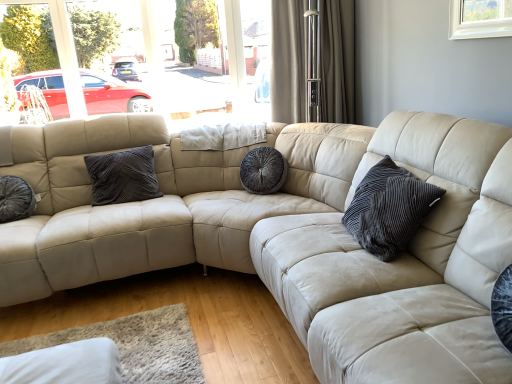
This screenshot has height=384, width=512. I want to click on beige leather couch at center, so click(x=290, y=235).

The width and height of the screenshot is (512, 384). What do you see at coordinates (123, 176) in the screenshot?
I see `dark grey velvet pillow at center, the second pillow when ordered from left to right` at bounding box center [123, 176].

You are a GUI agent. You are given a task and a screenshot of the screen. Output one action in this format:
    pyautogui.click(x=<x>, y=<y>)
    Task: Click on the velvet dark gray pillow at center, marked as the 3th pillow in a back-to-front arrangement
    This screenshot has width=512, height=384.
    Given the screenshot: What is the action you would take?
    pyautogui.click(x=389, y=209)

The image size is (512, 384). I want to click on velvet dark gray pillow at left, the 1th pillow viewed from the left, so click(x=16, y=199).

What do you see at coordinates (337, 61) in the screenshot? Image resolution: width=512 pixels, height=384 pixels. I see `beige textured curtain at upper center` at bounding box center [337, 61].

The height and width of the screenshot is (384, 512). What are the coordinates of `beige leather couch at center` in the screenshot? It's located at (290, 235).

Consider the image. Who is bigger, beige leather couch at center or velvet dark gray pillow at left, which appears as the 3th pillow when viewed from the right?

beige leather couch at center.

Which object is positioned more to the right, beige leather couch at center or velvet dark gray pillow at left, the 1th pillow viewed from the left?

Positioned to the right is beige leather couch at center.

You are a GUI agent. You are given a task and a screenshot of the screen. Output one action in this format:
    pyautogui.click(x=<x>, y=<y>)
    Task: Click on the studio couch that appears on the right of velvet dark gray pillow at left, which appears as the 3th pillow when viewed from the right
    
    Given the screenshot: What is the action you would take?
    pyautogui.click(x=290, y=235)

Considering the sizes of objects velvet dark gray pillow at center, which ranks as the 1th pillow in right-to-left order, and velvet dark gray pillow at left, placed as the 2th pillow when sorted from back to front, in the image provided, who is smaller, velvet dark gray pillow at center, which ranks as the 1th pillow in right-to-left order, or velvet dark gray pillow at left, placed as the 2th pillow when sorted from back to front,?

With smaller size is velvet dark gray pillow at left, placed as the 2th pillow when sorted from back to front.

From a real-world perspective, which object stands above the other?

velvet dark gray pillow at center, the first pillow positioned from the front.

Identify the location of the 2nd pillow directly above the velvet dark gray pillow at left, which appears as the 3th pillow when viewed from the right (from a real-world perspective). (389, 209).

Is velvet dark gray pillow at left, which ranks as the 2th pillow in front-to-back order, at the back of velvet dark gray pillow at center, the first pillow positioned from the front?

No, velvet dark gray pillow at center, the first pillow positioned from the front, is not facing the opposite direction of velvet dark gray pillow at left, which ranks as the 2th pillow in front-to-back order.

Is velvet dark gray pillow at left, which ranks as the 2th pillow in front-to-back order, positioned beyond the bounds of beige textured curtain at upper center?

Absolutely, velvet dark gray pillow at left, which ranks as the 2th pillow in front-to-back order, is external to beige textured curtain at upper center.

Who is shorter, velvet dark gray pillow at left, the 1th pillow viewed from the left, or beige textured curtain at upper center?

Standing shorter between the two is velvet dark gray pillow at left, the 1th pillow viewed from the left.

Is velvet dark gray pillow at left, placed as the 2th pillow when sorted from back to front, smaller than beige textured curtain at upper center?

Yes, velvet dark gray pillow at left, placed as the 2th pillow when sorted from back to front, is smaller than beige textured curtain at upper center.

Is velvet dark gray pillow at left, which ranks as the 2th pillow in front-to-back order, facing away from beige textured curtain at upper center?

velvet dark gray pillow at left, which ranks as the 2th pillow in front-to-back order, does not have its back to beige textured curtain at upper center.

From the image's perspective, between beige leather couch at center and beige textured curtain at upper center, who is located below?

beige leather couch at center.

Considering the relative sizes of beige leather couch at center and beige textured curtain at upper center in the image provided, is beige leather couch at center smaller than beige textured curtain at upper center?

Incorrect, beige leather couch at center is not smaller in size than beige textured curtain at upper center.

Is beige leather couch at center to the right of beige textured curtain at upper center from the viewer's perspective?

Yes.

Locate an element on the screen. The height and width of the screenshot is (384, 512). studio couch in front of the velvet dark gray pillow at center, the first pillow positioned from the front is located at coordinates (290, 235).

Is velvet dark gray pillow at center, the first pillow positioned from the front, positioned behind beige leather couch at center?

Yes, the depth of velvet dark gray pillow at center, the first pillow positioned from the front, is greater than that of beige leather couch at center.

Is point (373, 170) more distant than point (19, 146)?

No, (373, 170) is in front of (19, 146).

Could you measure the distance between velvet dark gray pillow at center, the first pillow positioned from the front, and beige leather couch at center?

13.11 inches.

Find the location of a particular element. the 1st pillow below the velvet dark gray pillow at center, the first pillow positioned from the front (from a real-world perspective) is located at coordinates (123, 176).

Is velvet dark gray pillow at center, marked as the 3th pillow in a back-to-front arrangement, oriented towards dark grey velvet pillow at center, arranged as the second pillow when viewed from the right?

No.

Is dark grey velvet pillow at center, marked as the 1th pillow in a back-to-front arrangement, located within velvet dark gray pillow at center, marked as the 3th pillow in a back-to-front arrangement?

That's incorrect, dark grey velvet pillow at center, marked as the 1th pillow in a back-to-front arrangement, is not inside velvet dark gray pillow at center, marked as the 3th pillow in a back-to-front arrangement.

Is point (291, 90) closer or farther from the camera than point (407, 258)?

Point (291, 90) is positioned farther from the camera compared to point (407, 258).

Is beige textured curtain at upper center far from beige leather couch at center?

Absolutely, beige textured curtain at upper center is distant from beige leather couch at center.

Who is shorter, beige textured curtain at upper center or beige leather couch at center?

With less height is beige textured curtain at upper center.

From the image's perspective, between beige textured curtain at upper center and beige leather couch at center, which one is located above?

beige textured curtain at upper center is shown above in the image.

At what (x,y) coordinates should I click in order to perform the action: click on the 3rd pillow to the left when counting from the beige leather couch at center. Please return your answer as a coordinate pair (x, y). The width and height of the screenshot is (512, 384). Looking at the image, I should click on (16, 199).

Identify the location of the 1st pillow behind the velvet dark gray pillow at center, the first pillow positioned from the front, starting your count from the anchor. click(x=16, y=199).

Considering their positions, is beige leather couch at center positioned further to beige textured curtain at upper center than velvet dark gray pillow at center, the first pillow positioned from the front?

velvet dark gray pillow at center, the first pillow positioned from the front, is further to beige textured curtain at upper center.

Based on their spatial positions, is dark grey velvet pillow at center, marked as the 1th pillow in a back-to-front arrangement, or beige textured curtain at upper center closer to beige leather couch at center?

Among the two, dark grey velvet pillow at center, marked as the 1th pillow in a back-to-front arrangement, is located nearer to beige leather couch at center.

From the image, which object appears to be nearer to velvet dark gray pillow at center, which is the third pillow in left-to-right order, dark grey velvet pillow at center, the second pillow when ordered from left to right, or beige textured curtain at upper center?

Based on the image, beige textured curtain at upper center appears to be nearer to velvet dark gray pillow at center, which is the third pillow in left-to-right order.

When comparing their distances from dark grey velvet pillow at center, arranged as the second pillow when viewed from the right, does velvet dark gray pillow at center, marked as the 3th pillow in a back-to-front arrangement, or velvet dark gray pillow at left, placed as the 2th pillow when sorted from back to front, seem further?

Based on the image, velvet dark gray pillow at center, marked as the 3th pillow in a back-to-front arrangement, appears to be further to dark grey velvet pillow at center, arranged as the second pillow when viewed from the right.

When comparing their distances from velvet dark gray pillow at center, which ranks as the 1th pillow in right-to-left order, does beige leather couch at center or dark grey velvet pillow at center, which appears as the 3th pillow when viewed from the front, seem further?

dark grey velvet pillow at center, which appears as the 3th pillow when viewed from the front, lies further to velvet dark gray pillow at center, which ranks as the 1th pillow in right-to-left order, than the other object.

Estimate the real-world distances between objects in this image. Which object is closer to velvet dark gray pillow at center, marked as the 3th pillow in a back-to-front arrangement, beige textured curtain at upper center or dark grey velvet pillow at center, which appears as the 3th pillow when viewed from the front?

beige textured curtain at upper center lies closer to velvet dark gray pillow at center, marked as the 3th pillow in a back-to-front arrangement, than the other object.

Based on their spatial positions, is beige textured curtain at upper center or beige leather couch at center closer to velvet dark gray pillow at center, which ranks as the 1th pillow in right-to-left order?

The object closer to velvet dark gray pillow at center, which ranks as the 1th pillow in right-to-left order, is beige leather couch at center.

Looking at this image, based on their spatial positions, is velvet dark gray pillow at center, the first pillow positioned from the front, or beige textured curtain at upper center further from velvet dark gray pillow at left, placed as the 2th pillow when sorted from back to front?

The object further to velvet dark gray pillow at left, placed as the 2th pillow when sorted from back to front, is beige textured curtain at upper center.

Locate an element on the screen. pillow situated between velvet dark gray pillow at left, which ranks as the 2th pillow in front-to-back order, and velvet dark gray pillow at center, which ranks as the 1th pillow in right-to-left order, from left to right is located at coordinates (123, 176).

You are a GUI agent. You are given a task and a screenshot of the screen. Output one action in this format:
    pyautogui.click(x=<x>, y=<y>)
    Task: Click on the curtain between dark grey velvet pillow at center, marked as the 1th pillow in a back-to-front arrangement, and velvet dark gray pillow at center, which is the third pillow in left-to-right order, from left to right
    
    Given the screenshot: What is the action you would take?
    pyautogui.click(x=337, y=61)

Identify the location of pillow located between velvet dark gray pillow at left, the 1th pillow viewed from the left, and beige textured curtain at upper center in the left-right direction. (123, 176).

Locate an element on the screen. Image resolution: width=512 pixels, height=384 pixels. curtain between velvet dark gray pillow at left, the 1th pillow viewed from the left, and velvet dark gray pillow at center, marked as the 3th pillow in a back-to-front arrangement, in the horizontal direction is located at coordinates (337, 61).